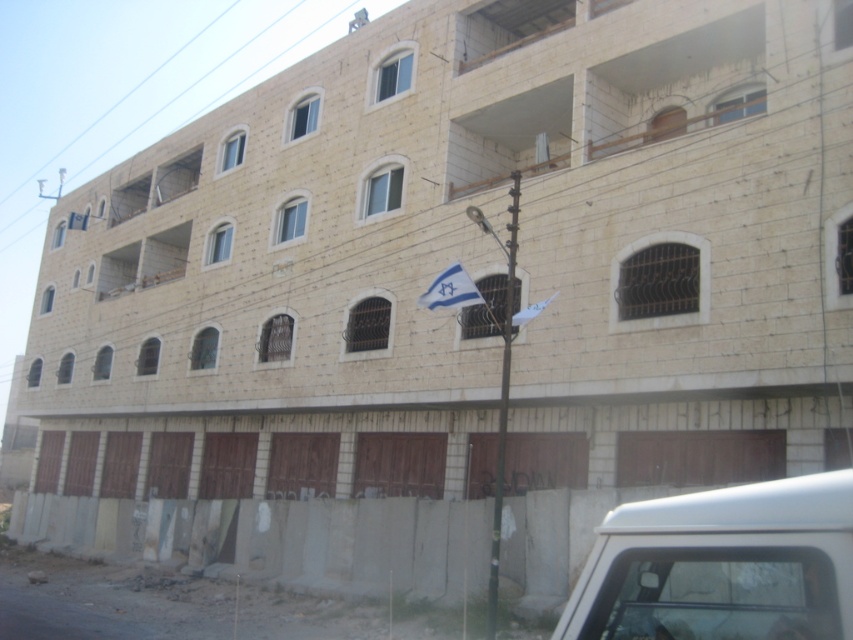
You are standing in front of the building and want to determine the distance between two points on its facade. The first point is at coordinates point [740,513] and the second is at point [451,282]. Which point is closer to you?

Point [740,513] is closer to the viewer than point [451,282].

You are a delivery driver who needs to park your white matte van at lower right. There is a blue fabric flag at center nearby. Can your van fit in the space next to the flag without overlapping it?

Result: The white matte van at lower right is thinner than the blue fabric flag at center, so it can fit in the space next to the flag without overlapping it.